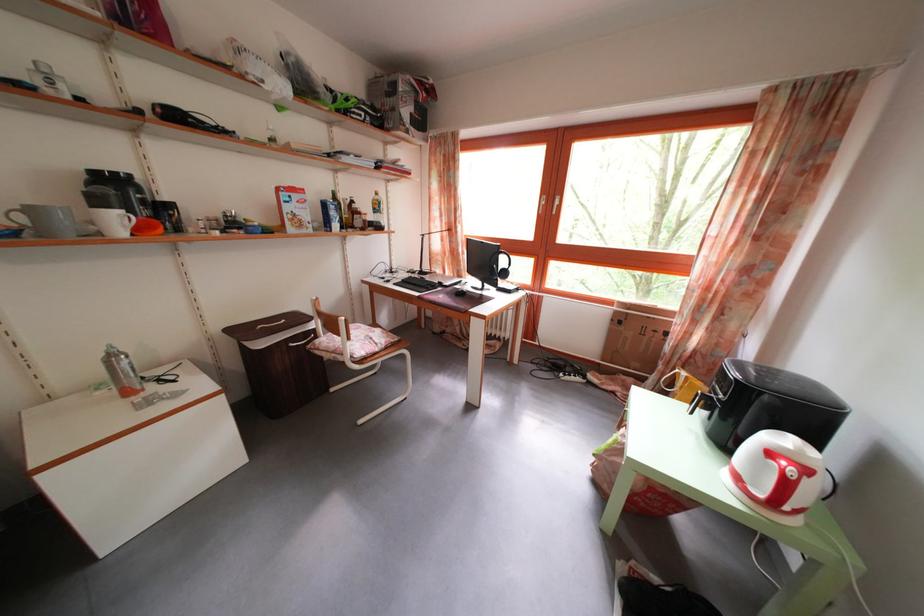
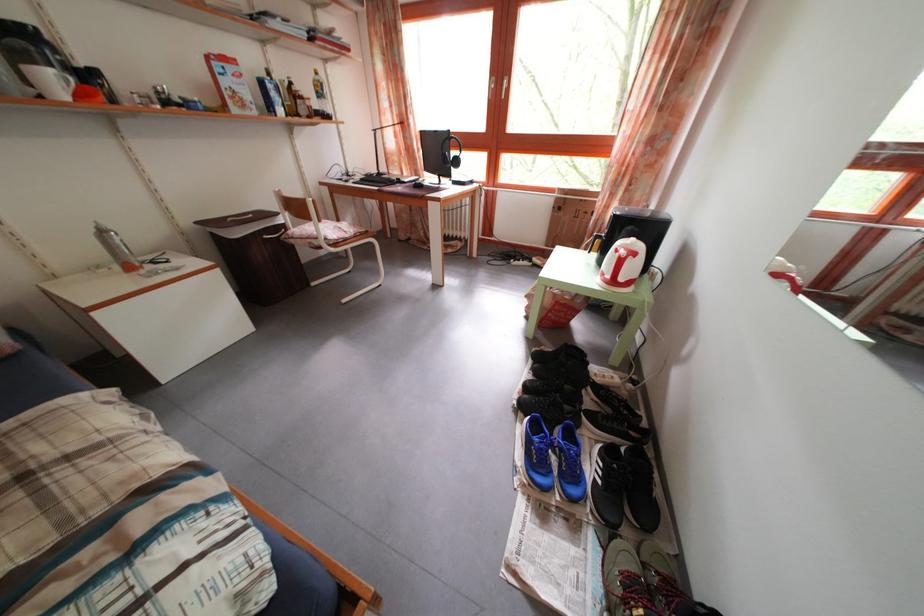
Find the pixel in the second image that matches (383,201) in the first image.

(323, 79)